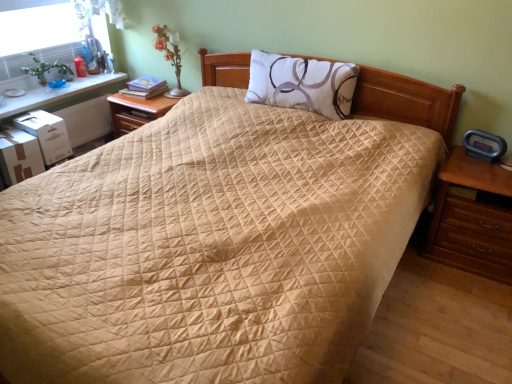
Question: From a real-world perspective, is brown wooden nightstand at right, arranged as the 2th nightstand when viewed from the back, above or below white glossy table at upper left?

Choices:
 (A) above
 (B) below

Answer: (B)

Question: From the image's perspective, is brown wooden nightstand at right, arranged as the 2th nightstand when viewed from the back, positioned above or below white glossy table at upper left?

Choices:
 (A) above
 (B) below

Answer: (B)

Question: Considering the real-world distances, which object is farthest from the brown wooden nightstand at right, arranged as the 2th nightstand when viewed from the back?

Choices:
 (A) matte white glass table lamp at upper left
 (B) white matte pillow at center
 (C) wooden nightstand at center-left, which ranks as the first nightstand in back-to-front order
 (D) white glossy table at upper left

Answer: (D)

Question: Estimate the real-world distances between objects in this image. Which object is farther from the matte white glass table lamp at upper left?

Choices:
 (A) white matte pillow at center
 (B) brown wooden nightstand at right, arranged as the 2th nightstand when viewed from the top
 (C) wooden nightstand at center-left, placed as the 1th nightstand when sorted from top to bottom
 (D) white glossy table at upper left

Answer: (B)